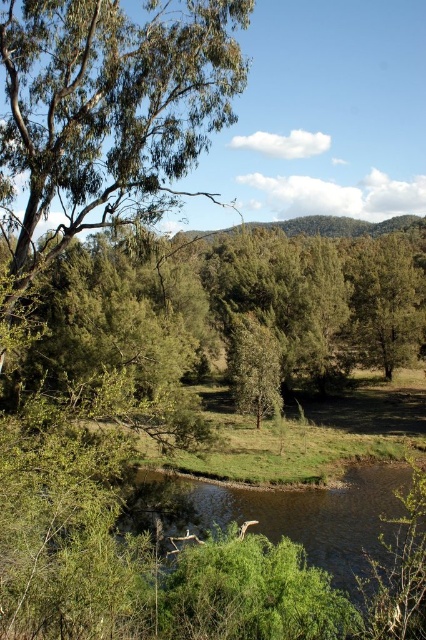
Question: Does green leafy tree at upper left appear on the right side of green matte tree at center?

Choices:
 (A) yes
 (B) no

Answer: (B)

Question: Estimate the real-world distances between objects in this image. Which object is farther from the brown/rocky river at center?

Choices:
 (A) green matte tree at center
 (B) green leafy tree at upper left

Answer: (A)

Question: Is green leafy tree at upper left bigger than green matte tree at center?

Choices:
 (A) no
 (B) yes

Answer: (A)

Question: Which is farther from the green matte tree at center?

Choices:
 (A) green leafy tree at upper left
 (B) brown/rocky river at center

Answer: (A)

Question: Is brown/rocky river at center bigger than green matte tree at center?

Choices:
 (A) yes
 (B) no

Answer: (A)

Question: Which object is the farthest from the brown/rocky river at center?

Choices:
 (A) green matte tree at center
 (B) green leafy tree at upper left

Answer: (A)